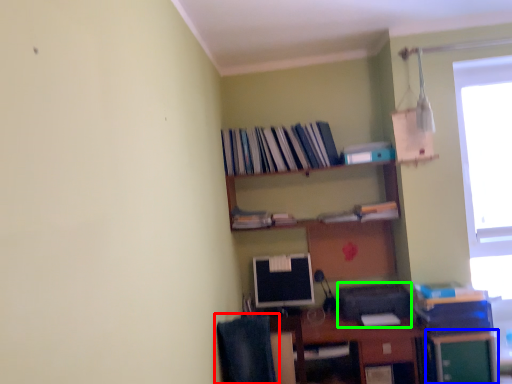
Question: Considering the real-world distances, which object is farthest from computer chair (highlighted by a red box)? file cabinet (highlighted by a blue box) or printer (highlighted by a green box)?

Choices:
 (A) file cabinet
 (B) printer

Answer: (A)